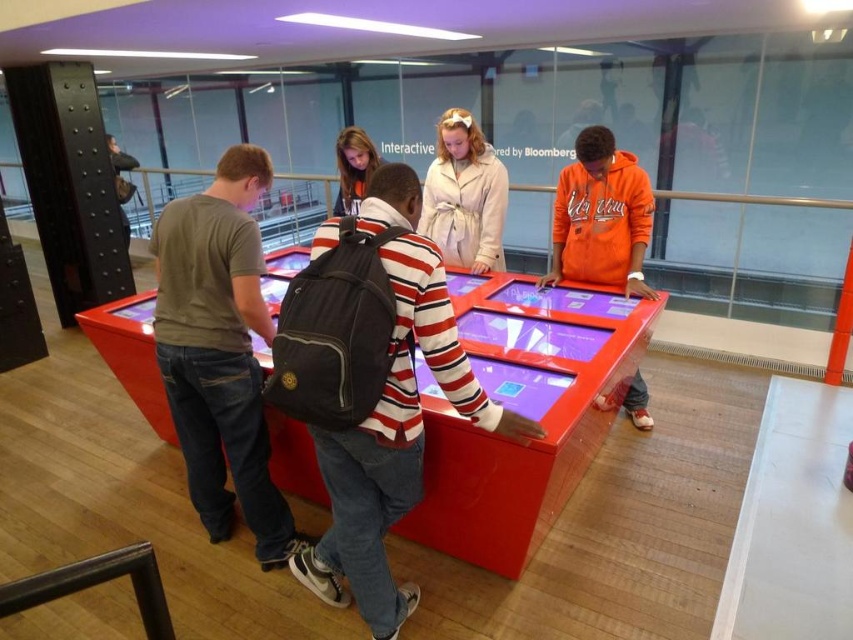
Question: Which point is farther to the camera?

Choices:
 (A) (556, 253)
 (B) (386, 195)
 (C) (341, 180)

Answer: (C)

Question: Can you confirm if orange fleece jacket at right is positioned to the left of light beige trench coat at center?

Choices:
 (A) no
 (B) yes

Answer: (A)

Question: Does matte gray shirt at left come behind striped cotton shirt at center?

Choices:
 (A) yes
 (B) no

Answer: (A)

Question: Which point appears closest to the camera in this image?

Choices:
 (A) (119, 161)
 (B) (347, 168)

Answer: (B)

Question: Considering the real-world distances, which object is closest to the matte black backpack at center?

Choices:
 (A) matte gray shirt at left
 (B) light beige trench coat at center
 (C) orange fleece jacket at right

Answer: (B)

Question: Does light beige trench coat at center appear over dark gray backpack at upper left?

Choices:
 (A) no
 (B) yes

Answer: (A)